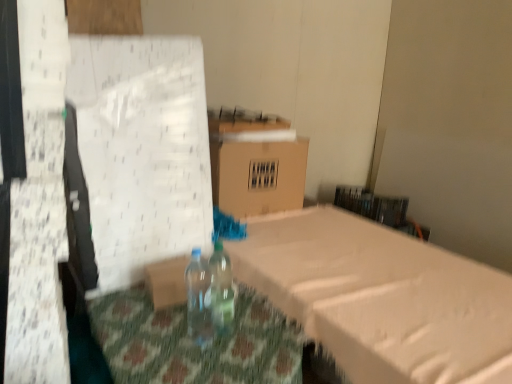
Identify the location of free space to the back side of translucent plastic bottle at center, the 1th bottle from the left. (194, 322).